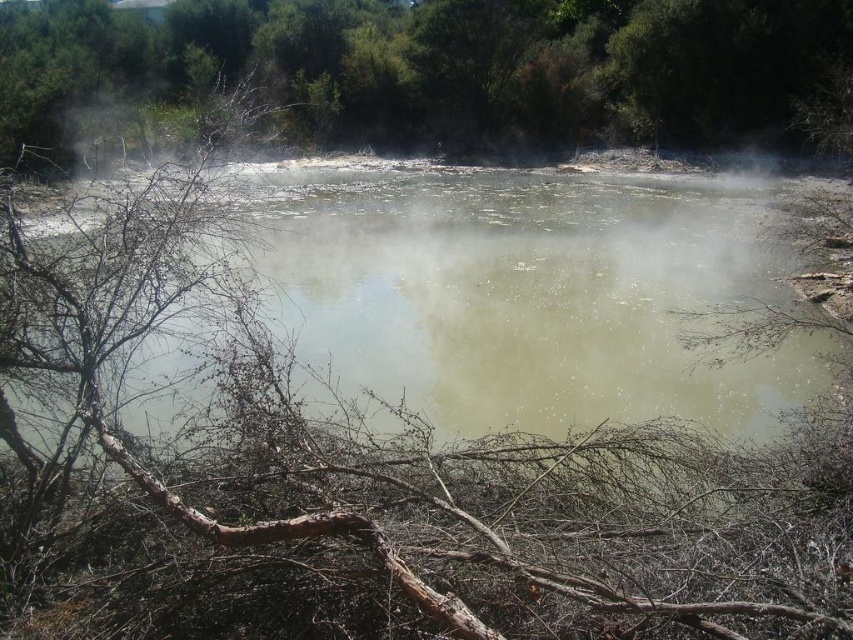
You are a hiker who wants to cross the green murky water at center. There is a green leafy tree at upper center nearby. Considering their widths, which one is narrower?

The green murky water at center has a lesser width compared to the green leafy tree at upper center, so the green murky water at center is narrower.

You are standing in front of the hot spring scene. You want to reach the green leafy tree at upper center. Which direction should you move to get closer to it, away from the green murky water at center?

To reach the green leafy tree at upper center, you should move away from the green murky water at center since the tree is further back in the scene.